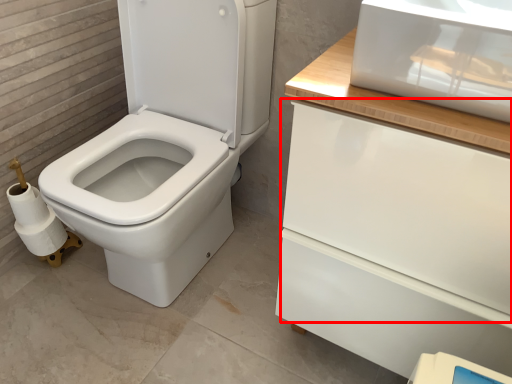
Question: In this image, where is drawer (annotated by the red box) located relative to toilet paper?

Choices:
 (A) left
 (B) right

Answer: (B)